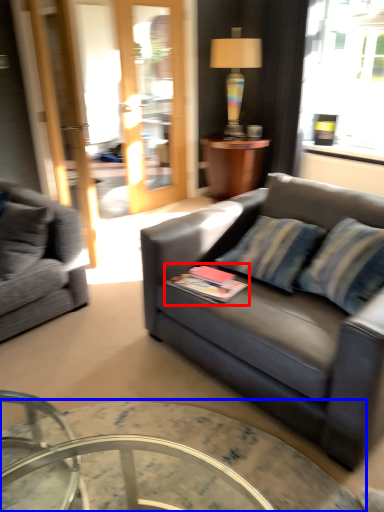
Question: Which object is further to the camera taking this photo, book (highlighted by a red box) or coffee table (highlighted by a blue box)?

Choices:
 (A) book
 (B) coffee table

Answer: (A)